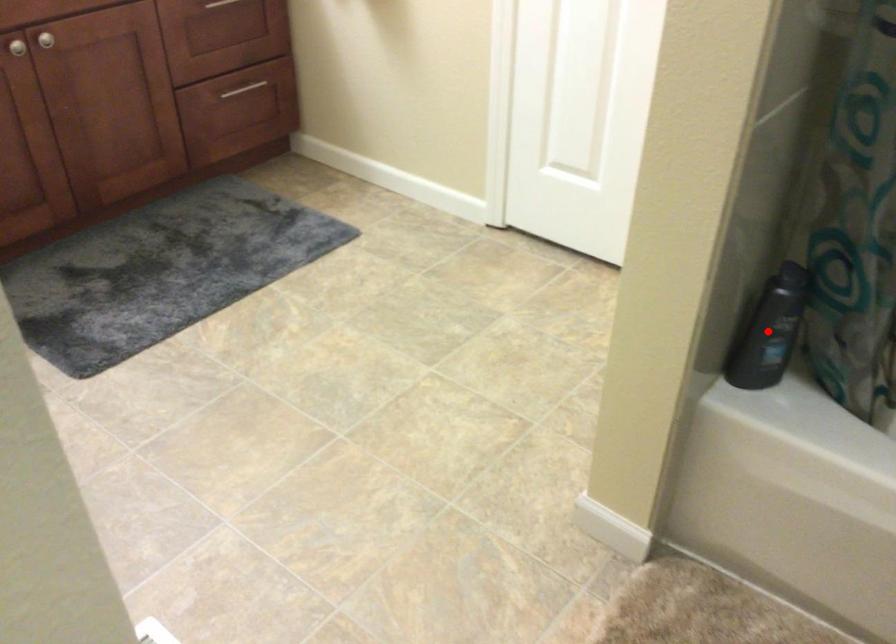
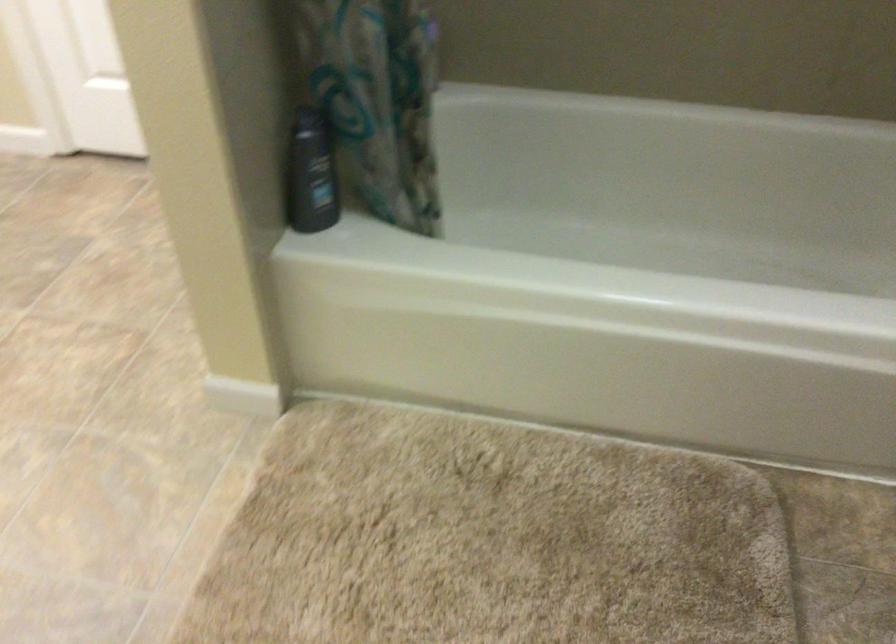
In the second image, find the point that corresponds to the highlighted location in the first image.

(311, 174)